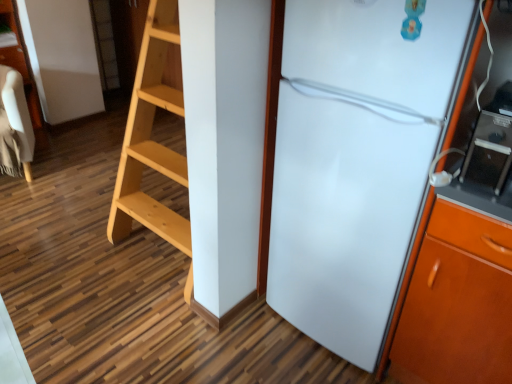
Where is `free location to the left of white glossy refrigerator at right`? This screenshot has width=512, height=384. free location to the left of white glossy refrigerator at right is located at coordinates (232, 340).